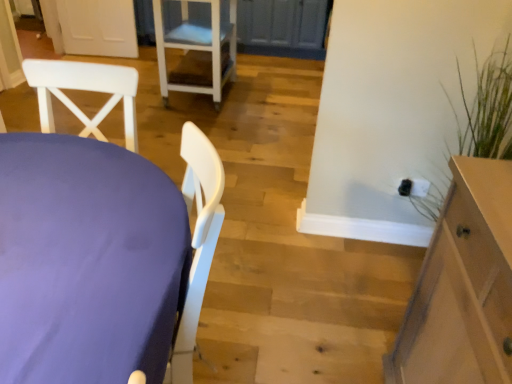
Based on the photo, measure the distance between light brown wood cabinet at right and camera.

light brown wood cabinet at right and camera are 29.13 inches apart.

Find the location of `white plastic chair at upper center`. white plastic chair at upper center is located at coordinates (198, 46).

Where is `light brown wood cabinet at right`? light brown wood cabinet at right is located at coordinates (463, 286).

Is purple fabric table at left looking in the opposite direction of white plastic chair at upper center?

No, purple fabric table at left is not facing the opposite direction of white plastic chair at upper center.

In terms of width, does purple fabric table at left look wider or thinner when compared to white plastic chair at upper center?

Clearly, purple fabric table at left has less width compared to white plastic chair at upper center.

Can you tell me how much purple fabric table at left and white plastic chair at upper center differ in facing direction?

The angular difference between purple fabric table at left and white plastic chair at upper center is 15.9 degrees.

From the picture: Is the surface of purple fabric table at left in direct contact with white plastic chair at upper center?

No.

Which object is wider, purple fabric table at left or light brown wood cabinet at right?

Wider between the two is light brown wood cabinet at right.

From a real-world perspective, does purple fabric table at left stand above light brown wood cabinet at right?

No, from a real-world perspective, purple fabric table at left is not on top of light brown wood cabinet at right.

Can light brown wood cabinet at right be found inside purple fabric table at left?

No, light brown wood cabinet at right is not a part of purple fabric table at left.

From the image's perspective, which one is positioned lower, purple fabric table at left or light brown wood cabinet at right?

light brown wood cabinet at right, from the image's perspective.

Is white plastic chair at upper center bigger than light brown wood cabinet at right?

Yes, white plastic chair at upper center is bigger than light brown wood cabinet at right.

From a real-world perspective, between white plastic chair at upper center and light brown wood cabinet at right, who is vertically lower?

white plastic chair at upper center is physically lower.

Based on the photo, does white plastic chair at upper center have a greater height compared to light brown wood cabinet at right?

No, white plastic chair at upper center is not taller than light brown wood cabinet at right.

Considering the relative positions of white plastic chair at upper center and purple fabric table at left in the image provided, is white plastic chair at upper center to the left or to the right of purple fabric table at left?

From the image, it's evident that white plastic chair at upper center is to the left of purple fabric table at left.

From a real-world perspective, does white plastic chair at upper center stand above purple fabric table at left?

No, from a real-world perspective, white plastic chair at upper center is not over purple fabric table at left

Find the location of `table above the white plastic chair at upper center (from a real-world perspective)`. table above the white plastic chair at upper center (from a real-world perspective) is located at coordinates (87, 261).

Considering the sizes of objects light brown wood cabinet at right and white plastic chair at upper center in the image provided, who is smaller, light brown wood cabinet at right or white plastic chair at upper center?

Smaller between the two is light brown wood cabinet at right.

Relative to white plastic chair at upper center, is light brown wood cabinet at right in front or behind?

In the image, light brown wood cabinet at right appears in front of white plastic chair at upper center.

Locate an element on the screen. The height and width of the screenshot is (384, 512). cabinetry located below the white plastic chair at upper center (from the image's perspective) is located at coordinates click(463, 286).

From a real-world perspective, is light brown wood cabinet at right positioned over white plastic chair at upper center based on gravity?

Correct, in the physical world, light brown wood cabinet at right is higher than white plastic chair at upper center.

Measure the distance from light brown wood cabinet at right to purple fabric table at left.

A distance of 30.93 inches exists between light brown wood cabinet at right and purple fabric table at left.

Looking at their sizes, would you say light brown wood cabinet at right is wider or thinner than purple fabric table at left?

light brown wood cabinet at right is wider than purple fabric table at left.

From the image's perspective, is light brown wood cabinet at right above or below purple fabric table at left?

From the image's perspective, light brown wood cabinet at right appears below purple fabric table at left.

Which object is positioned more to the right, light brown wood cabinet at right or purple fabric table at left?

light brown wood cabinet at right.

This screenshot has width=512, height=384. Find the location of `chair that is above the purple fabric table at left (from the image's perspective)`. chair that is above the purple fabric table at left (from the image's perspective) is located at coordinates (198, 46).

Where is `cabinetry that is in front of the purple fabric table at left`? Image resolution: width=512 pixels, height=384 pixels. cabinetry that is in front of the purple fabric table at left is located at coordinates (463, 286).

When comparing their distances from white plastic chair at upper center, does light brown wood cabinet at right or purple fabric table at left seem closer?

The object closer to white plastic chair at upper center is purple fabric table at left.

Based on their spatial positions, is white plastic chair at upper center or purple fabric table at left closer to light brown wood cabinet at right?

purple fabric table at left is closer to light brown wood cabinet at right.

Considering their positions, is purple fabric table at left positioned further to white plastic chair at upper center than light brown wood cabinet at right?

light brown wood cabinet at right lies further to white plastic chair at upper center than the other object.

Which object lies further to the anchor point light brown wood cabinet at right, purple fabric table at left or white plastic chair at upper center?

white plastic chair at upper center.

Which object lies further to the anchor point purple fabric table at left, light brown wood cabinet at right or white plastic chair at upper center?

white plastic chair at upper center is positioned further to the anchor purple fabric table at left.

Which object lies nearer to the anchor point purple fabric table at left, white plastic chair at upper center or light brown wood cabinet at right?

light brown wood cabinet at right lies closer to purple fabric table at left than the other object.

The width and height of the screenshot is (512, 384). Identify the location of table positioned between light brown wood cabinet at right and white plastic chair at upper center from near to far. (87, 261).